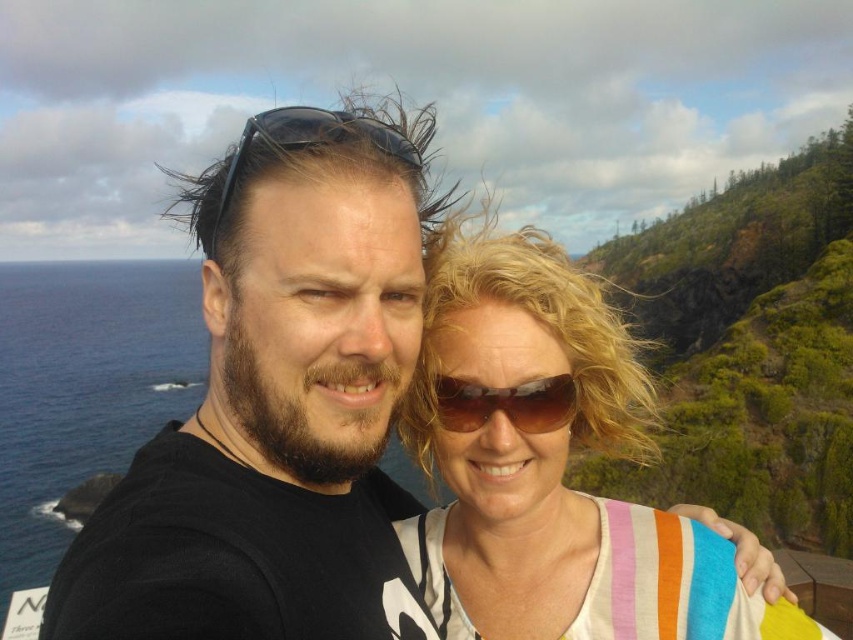
You are a photographer trying to capture a wide shot of the scene. The two people are standing 32.46 feet apart. If your camera has a maximum focus range of 30 feet, will you be able to capture both the white striped shirt at center and the sunglasses at center in focus at the same time?

The distance between the white striped shirt at center and sunglasses at center is 32.46 feet, which exceeds the camera maximum focus range of 30 feet. Therefore, you cannot capture both in focus simultaneously.

You are a photographer trying to capture the perfect shot of the two people in the image. You want to ensure that both the white striped shirt at center and the sunglasses at center are clearly visible in the photo. Based on their positions, which object should you focus on first to ensure both are in focus?

The white striped shirt at center is taller than sunglasses at center. Therefore, focusing on the white striped shirt at center first will ensure both objects are in focus since it is the taller object and likely further away.